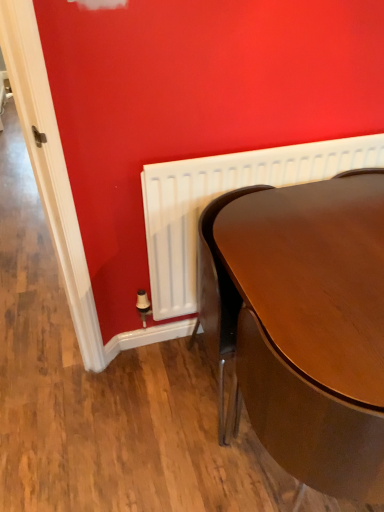
Question: Considering the relative positions of glossy wood table at right and white plastic radiator at lower left in the image provided, is glossy wood table at right to the left of white plastic radiator at lower left from the viewer's perspective?

Choices:
 (A) yes
 (B) no

Answer: (B)

Question: From a real-world perspective, is glossy wood table at right beneath white plastic radiator at lower left?

Choices:
 (A) no
 (B) yes

Answer: (B)

Question: Does glossy wood table at right come in front of white plastic radiator at lower left?

Choices:
 (A) no
 (B) yes

Answer: (B)

Question: Is white plastic radiator at lower left inside glossy wood table at right?

Choices:
 (A) no
 (B) yes

Answer: (A)

Question: Is glossy wood table at right positioned with its back to white plastic radiator at lower left?

Choices:
 (A) yes
 (B) no

Answer: (A)

Question: Can you confirm if glossy wood table at right is shorter than white plastic radiator at lower left?

Choices:
 (A) no
 (B) yes

Answer: (A)

Question: Is white plastic radiator at lower left not inside glossy wood table at right?

Choices:
 (A) no
 (B) yes

Answer: (B)

Question: Does white plastic radiator at lower left appear on the right side of glossy wood table at right?

Choices:
 (A) yes
 (B) no

Answer: (B)

Question: Is white plastic radiator at lower left positioned before glossy wood table at right?

Choices:
 (A) no
 (B) yes

Answer: (A)

Question: Are white plastic radiator at lower left and glossy wood table at right far apart?

Choices:
 (A) no
 (B) yes

Answer: (A)

Question: Does white plastic radiator at lower left touch glossy wood table at right?

Choices:
 (A) no
 (B) yes

Answer: (A)

Question: Does white plastic radiator at lower left lie behind glossy wood table at right?

Choices:
 (A) no
 (B) yes

Answer: (B)

Question: In the image, is white plastic radiator at lower left on the left side or the right side of glossy wood table at right?

Choices:
 (A) right
 (B) left

Answer: (B)